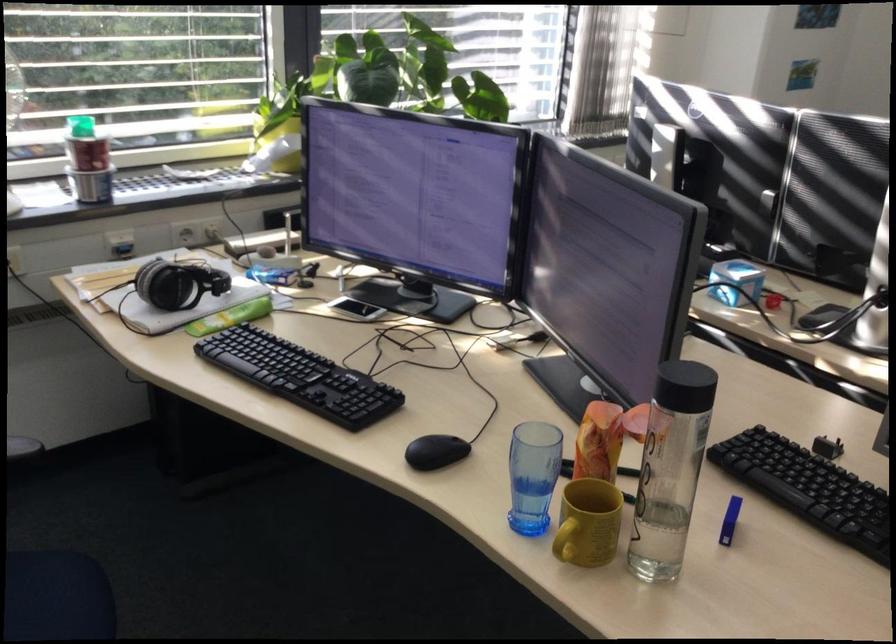
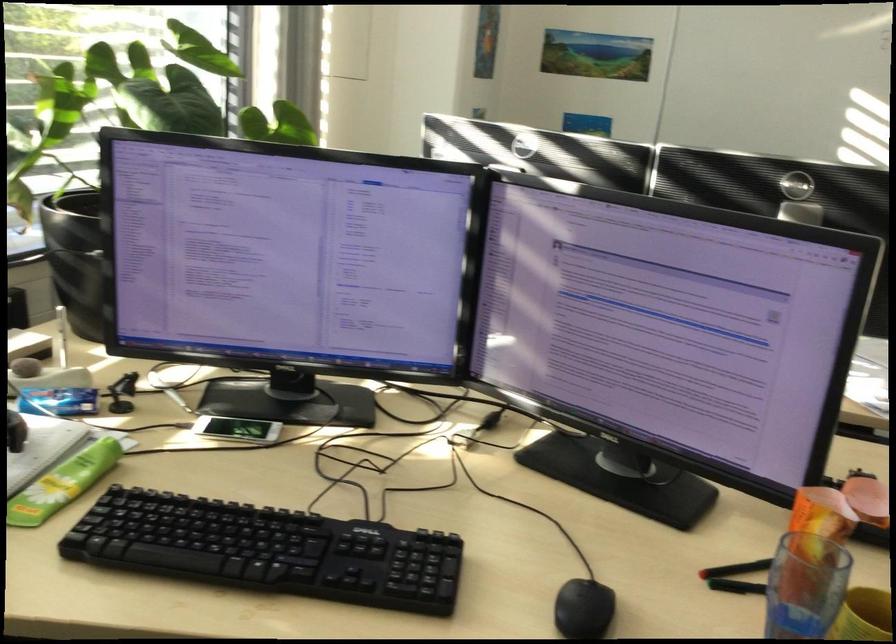
Find the pixel in the second image that matches pixel 600 424 in the first image.

(822, 514)